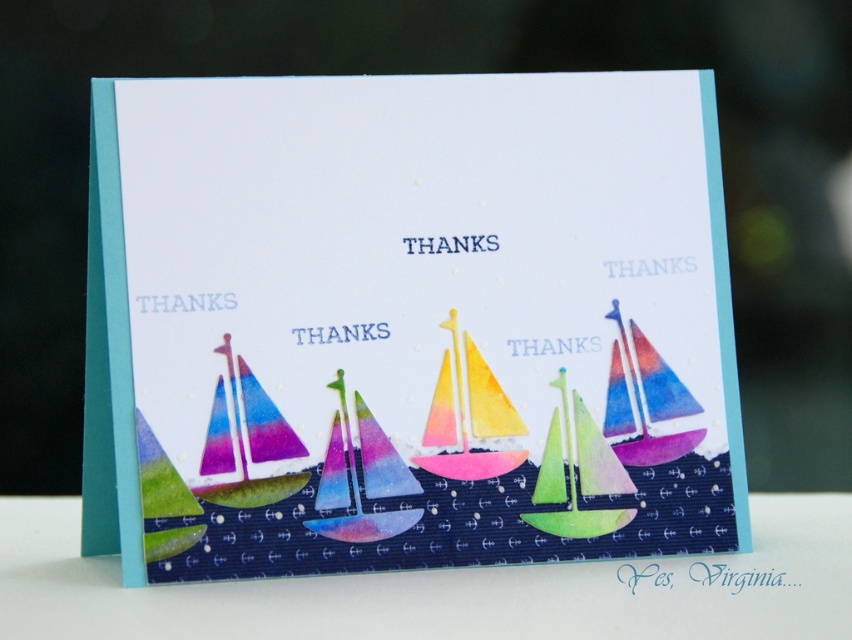
You are holding this greeting card and want to place it on a shelf that is 1 meter away from you. Can you place the white paper at lower center on the shelf without moving closer?

The white paper at lower center is 1.06 meters from the camera, which is slightly farther than the shelf distance of 1 meter. Therefore, you cannot place it on the shelf without moving closer.

You are designing a greeting card and want to place a sticker on the card. You have two points marked on the card at coordinates point (199, 256) and point (448, 435). If you want the sticker to be closer to the viewer, which point should you choose?

Point (199, 256) is in front of point (448, 435), so you should choose point (199, 256) to place the sticker closer to the viewer.